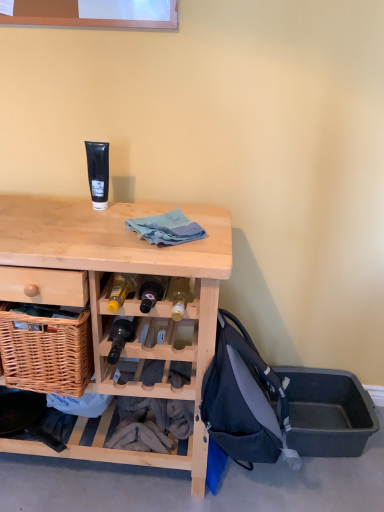
Identify the location of vacant space in dark blue fabric backpack at lower right (from a real-world perspective). (255, 489).